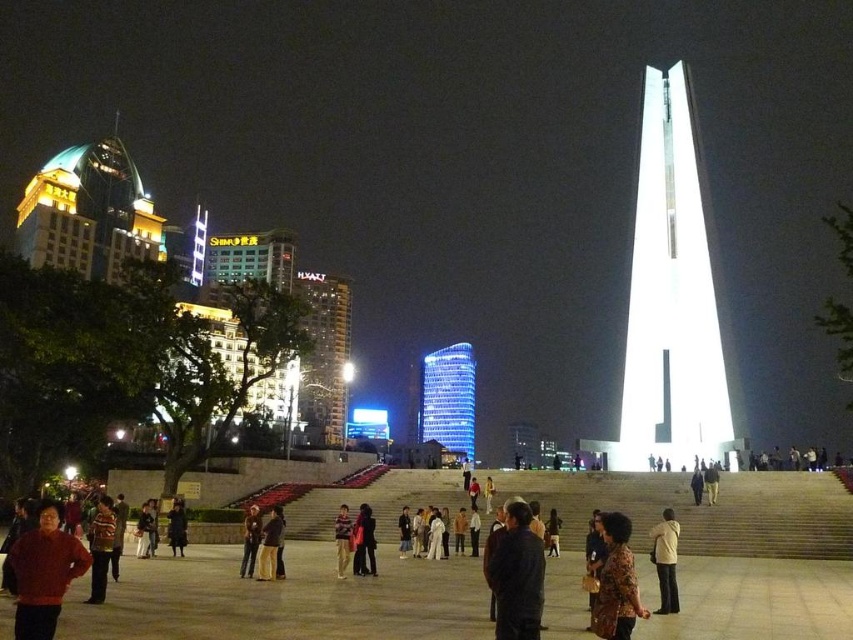
Question: Which of the following is the closest to the observer?

Choices:
 (A) (659, 522)
 (B) (339, 508)
 (C) (434, 417)
 (D) (335, 324)

Answer: (A)

Question: Among these points, which one is nearest to the camera?

Choices:
 (A) (312, 321)
 (B) (627, 584)
 (C) (471, 369)

Answer: (B)

Question: Where is matte red sweater at lower left located in relation to printed fabric jacket at lower center in the image?

Choices:
 (A) above
 (B) below

Answer: (A)

Question: Is the position of matte red sweater at lower left more distant than that of printed fabric jacket at lower center?

Choices:
 (A) no
 (B) yes

Answer: (A)

Question: Which object appears closest to the camera in this image?

Choices:
 (A) white glossy tower at center
 (B) glassy reflective building at center-left

Answer: (A)

Question: Is dark gray suit at center thinner than striped sweater at lower left?

Choices:
 (A) no
 (B) yes

Answer: (B)